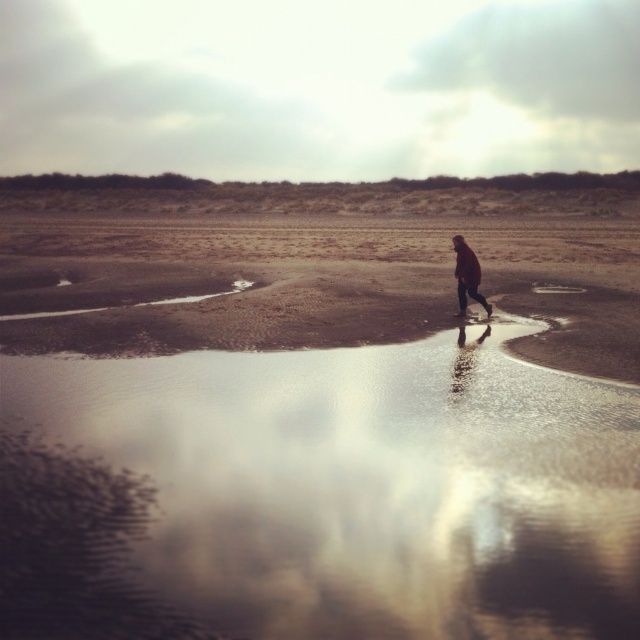
You are standing on the beach and notice the glossy reflective water at center and the matte brown coat at center. Which object is taller from your perspective?

The matte brown coat at center is taller than the glossy reflective water at center.

You are standing on the beach and see both the glossy reflective water at center and the glossy reflective puddle at center. Which one is positioned to the left?

The glossy reflective water at center is positioned to the left of the glossy reflective puddle at center.

You are a photographer trying to capture the reflection of the cloudy sky. You have two options to focus on the glossy reflective water at center and the glossy reflective puddle at center. Which one would provide a more complete reflection of the sky?

The glossy reflective water at center has a larger size compared to glossy reflective puddle at center, so it would provide a more complete reflection of the sky.